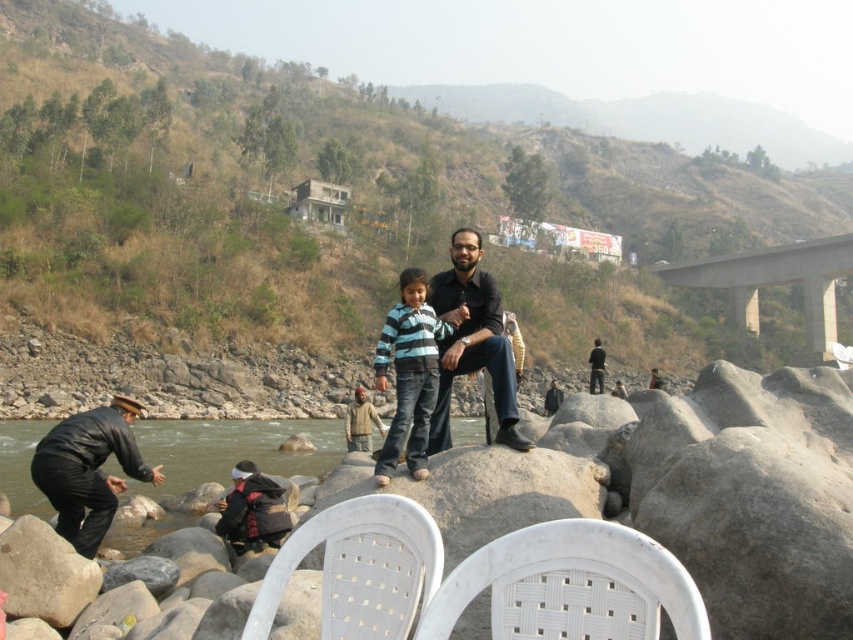
Who is taller, matte black shirt at center or dark brown leather jacket at center?

With more height is matte black shirt at center.

Does matte black shirt at center have a lesser width compared to dark brown leather jacket at center?

Yes.

Who is more distant from viewer, (473, 289) or (601, 388)?

Point (601, 388)

Identify the location of matte black shirt at center. This screenshot has width=853, height=640. (471, 340).

Image resolution: width=853 pixels, height=640 pixels. Describe the element at coordinates (357, 195) in the screenshot. I see `brown grassy hillside at upper left` at that location.

Locate an element on the screen. brown grassy hillside at upper left is located at coordinates (357, 195).

Consider the image. Who is more distant from viewer, (x=660, y=320) or (x=519, y=592)?

Positioned behind is point (x=660, y=320).

You are a GUI agent. You are given a task and a screenshot of the screen. Output one action in this format:
    pyautogui.click(x=<x>, y=<y>)
    Task: Click on the brown grassy hillside at upper left
    This screenshot has height=640, width=853.
    Given the screenshot: What is the action you would take?
    pyautogui.click(x=357, y=195)